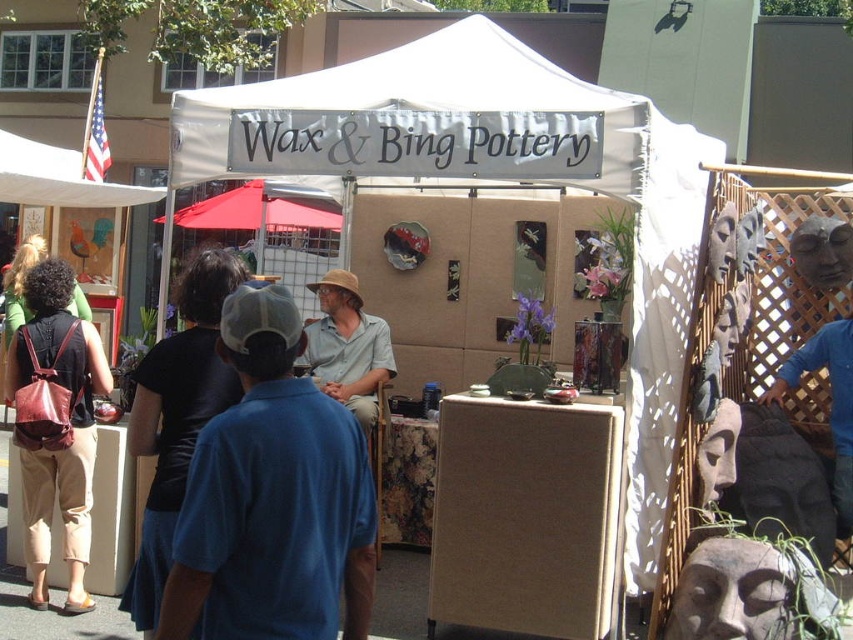
You are a customer at the market and want to know if you can place your brown leather backpack at left on top of the red fabric canopy at upper center without it falling off. Based on their heights, is this possible?

The brown leather backpack at left is taller than the red fabric canopy at upper center, so placing it on top might cause instability and could result in the backpack falling off.

You are a customer at the market stall and want to find your friend who is holding a brown leather backpack at left. Your friend is currently standing near the red fabric canopy at upper center. Which direction should you look to find them?

The brown leather backpack at left is to the right of the red fabric canopy at upper center, so you should look to the right of the red fabric canopy at upper center to find your friend.